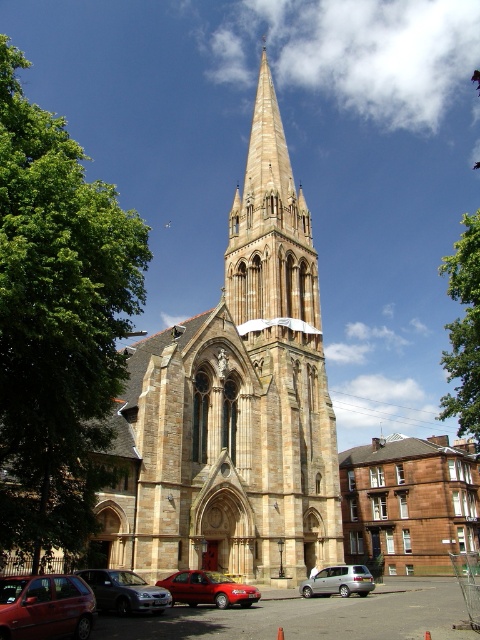
Question: Based on their relative distances, which object is farther from the metallic red car at lower left?

Choices:
 (A) silver metallic van at lower center
 (B) shiny red sedan at center

Answer: (A)

Question: Is the position of brown stone church at center less distant than that of silver metallic van at lower center?

Choices:
 (A) no
 (B) yes

Answer: (B)

Question: Does green leafy tree at upper right appear over metallic red car at lower left?

Choices:
 (A) yes
 (B) no

Answer: (A)

Question: Is green leafy tree at left below silver metallic van at lower center?

Choices:
 (A) yes
 (B) no

Answer: (B)

Question: Which point is closer to the camera?

Choices:
 (A) (36, 632)
 (B) (197, 586)

Answer: (A)

Question: Which of the following is the closest to the observer?

Choices:
 (A) metallic red car at lower left
 (B) green leafy tree at left

Answer: (B)